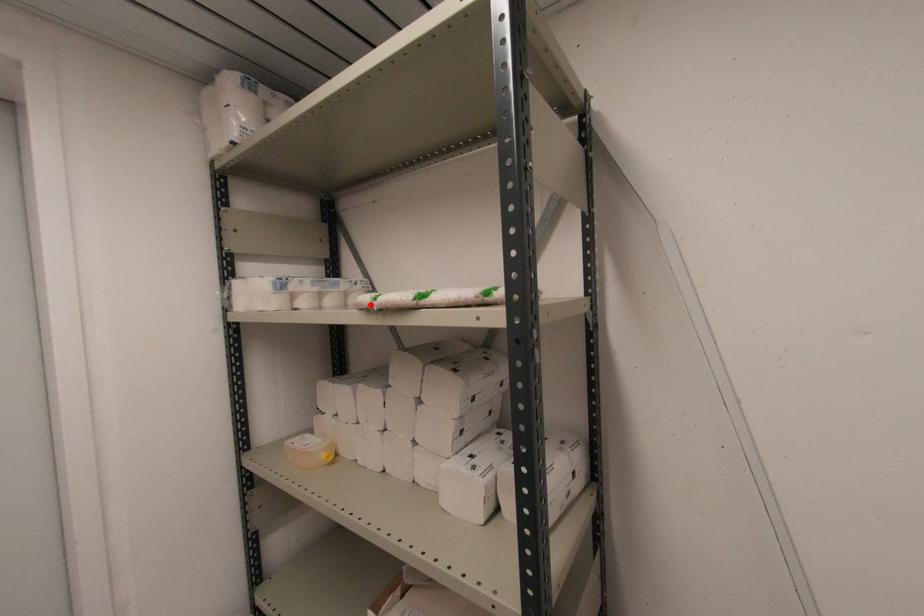
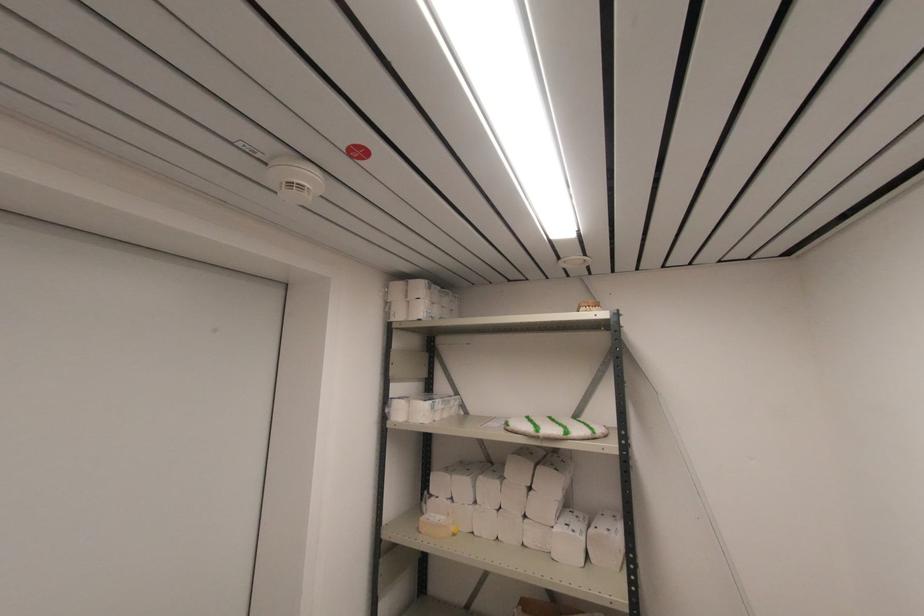
Question: I am providing you with two images of the same scene from different viewpoints. A red point is marked on the first image. At the location where the point appears in image 1, is it still visible in image 2?

Choices:
 (A) Yes
 (B) No

Answer: (A)